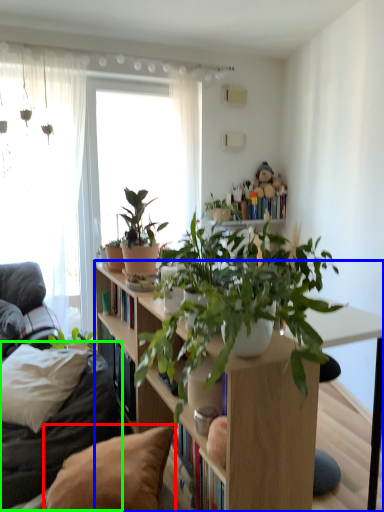
Question: Which is nearer to the pillow (highlighted by a red box)? bookcase (highlighted by a blue box) or couch (highlighted by a green box).

Choices:
 (A) bookcase
 (B) couch

Answer: (A)